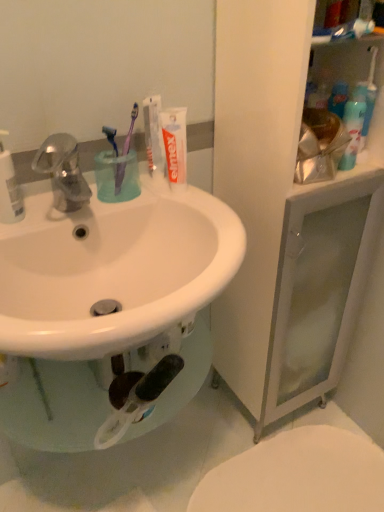
This screenshot has width=384, height=512. In order to click on vacant area that lies between white plastic bottle at left, positioned as the second cleaning product in right-to-left order, and white matte toothpaste at upper center, the 2th toothpaste in the left-to-right sequence in this screenshot , I will do `click(91, 205)`.